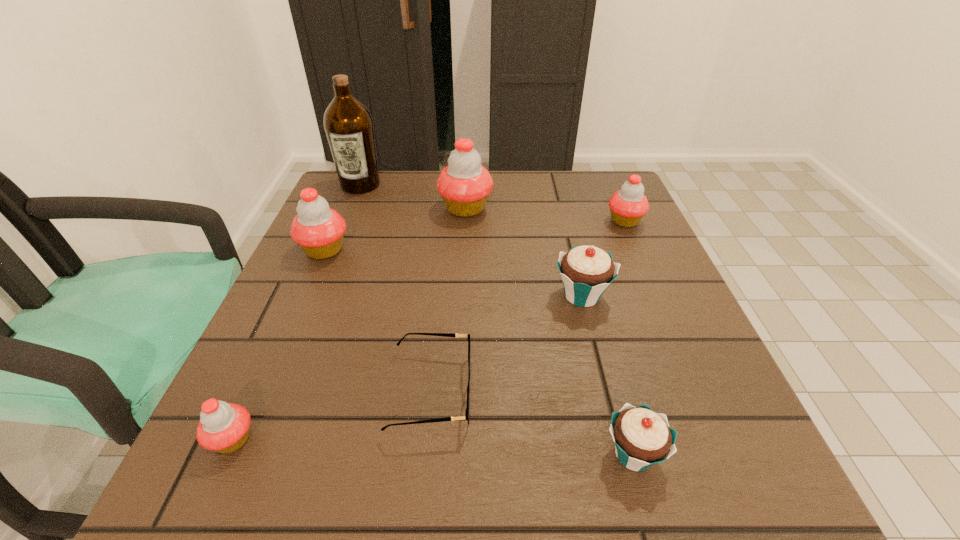
This screenshot has height=540, width=960. Identify the location of vacant area between the smaller teal cupcake and the olive oil. (497, 319).

I want to click on free point between the third cupcake from left to right and the rightmost object, so click(x=545, y=215).

Locate an element on the screen. free space between the second red cupcake from right to left and the spectacles is located at coordinates (448, 300).

Identify the location of vacant area between the fourth farthest object and the rightmost red cupcake. This screenshot has width=960, height=540. point(474,235).

Find the location of a particular element. the third closest object to the smallest red cupcake is located at coordinates pyautogui.click(x=642, y=438).

The height and width of the screenshot is (540, 960). I want to click on object that is the third closest one to the rightmost cupcake, so click(x=467, y=411).

At what (x,y) coordinates should I click in order to perform the action: click on cupcake that is the closest to the nearest red cupcake. Please return your answer as a coordinate pair (x, y). Looking at the image, I should click on (319, 230).

Identify the location of cupcake that is the closest one to the shortest object. The width and height of the screenshot is (960, 540). (586, 271).

This screenshot has width=960, height=540. I want to click on red cupcake that stands as the third closest to the rightmost object, so click(x=224, y=427).

The width and height of the screenshot is (960, 540). Find the location of `red cupcake that stands as the second closest to the second biggest red cupcake`. red cupcake that stands as the second closest to the second biggest red cupcake is located at coordinates (224, 427).